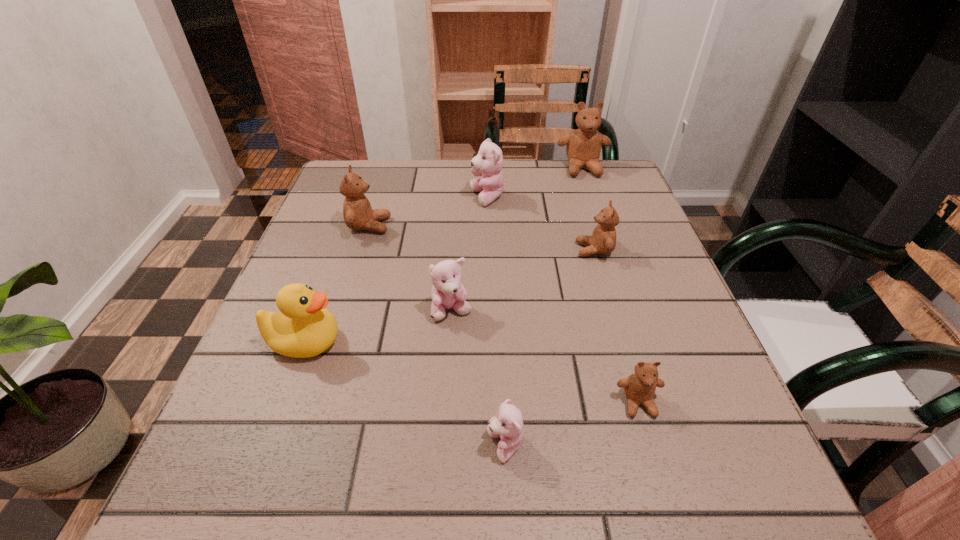
You are a GUI agent. You are given a task and a screenshot of the screen. Output one action in this format:
    pyautogui.click(x=<x>, y=<y>)
    Task: Click on the vacant space located on the face of the second smallest brown teddy bear
    
    Given the screenshot: What is the action you would take?
    pyautogui.click(x=550, y=250)

Where is `vacant space situated 0.130m on the face of the second smallest brown teddy bear`? vacant space situated 0.130m on the face of the second smallest brown teddy bear is located at coordinates (518, 250).

At what (x,y) coordinates should I click in order to perform the action: click on free space located 0.060m on the face of the second smallest brown teddy bear. Please return your answer as a coordinate pair (x, y). Looking at the image, I should click on (550, 250).

This screenshot has height=540, width=960. I want to click on free location located 0.110m at the face of the second smallest pink teddy bear, so click(x=448, y=374).

In order to click on vacant space located on the face of the smallest brown teddy bear in this screenshot , I will do pyautogui.click(x=662, y=486).

Find the location of a particular element. The width and height of the screenshot is (960, 540). free spot located at the face of the smallest pink teddy bear is located at coordinates (433, 446).

At what (x,y) coordinates should I click in order to perform the action: click on free space located at the face of the smallest pink teddy bear. Please return your answer as a coordinate pair (x, y). This screenshot has width=960, height=540. Looking at the image, I should click on (352, 446).

The height and width of the screenshot is (540, 960). Identify the location of free point located at the face of the smallest pink teddy bear. (446, 446).

Locate an element on the screen. object that is at the near edge is located at coordinates (508, 423).

Locate an element on the screen. teddy bear located at the left edge is located at coordinates (358, 214).